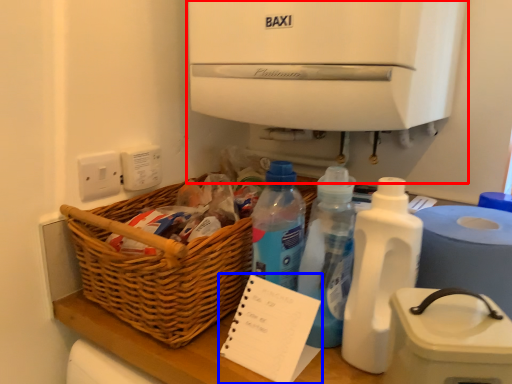
Question: Which object is further to the camera taking this photo, water cooler (highlighted by a red box) or notepad (highlighted by a blue box)?

Choices:
 (A) water cooler
 (B) notepad

Answer: (A)